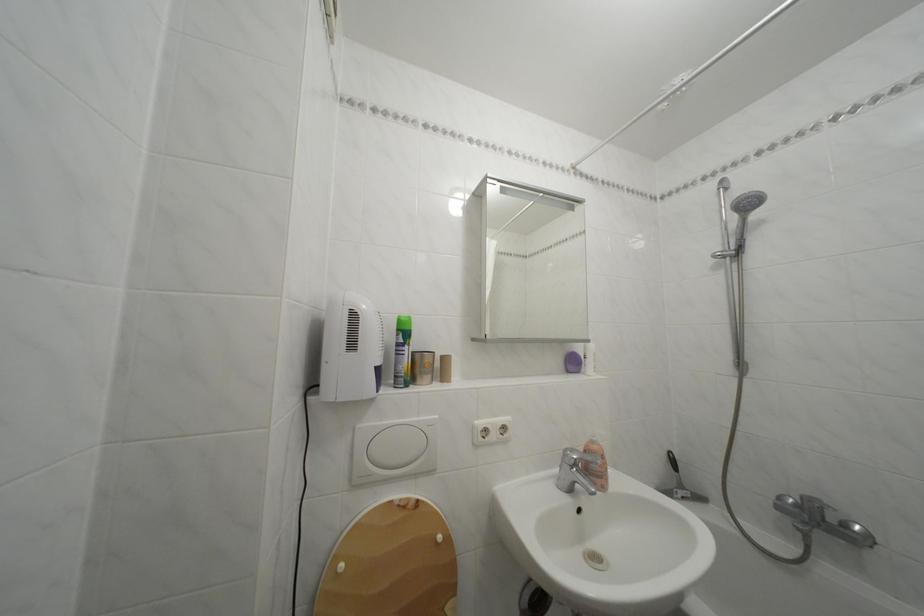
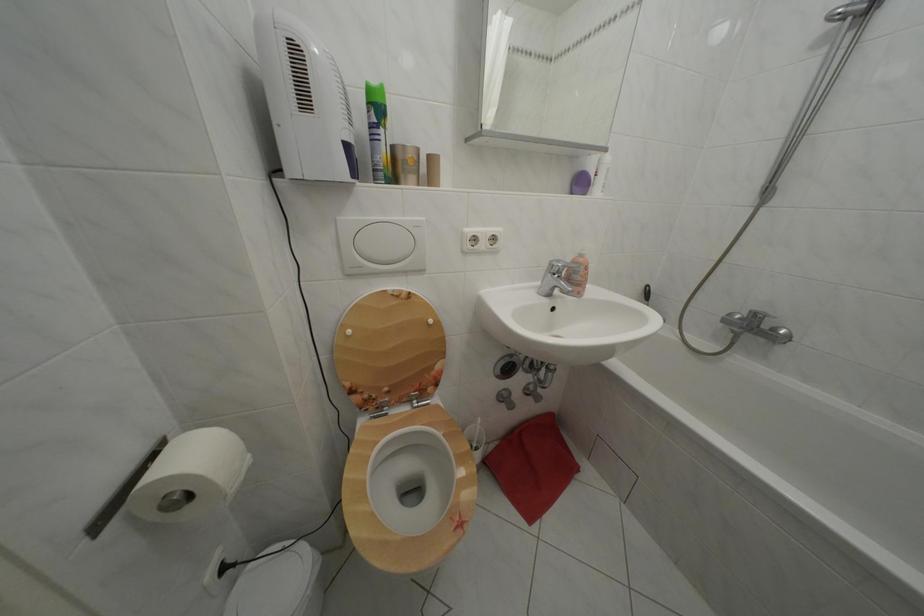
Locate, in the second image, the point that corresponds to pixel 407 336 in the first image.

(378, 110)